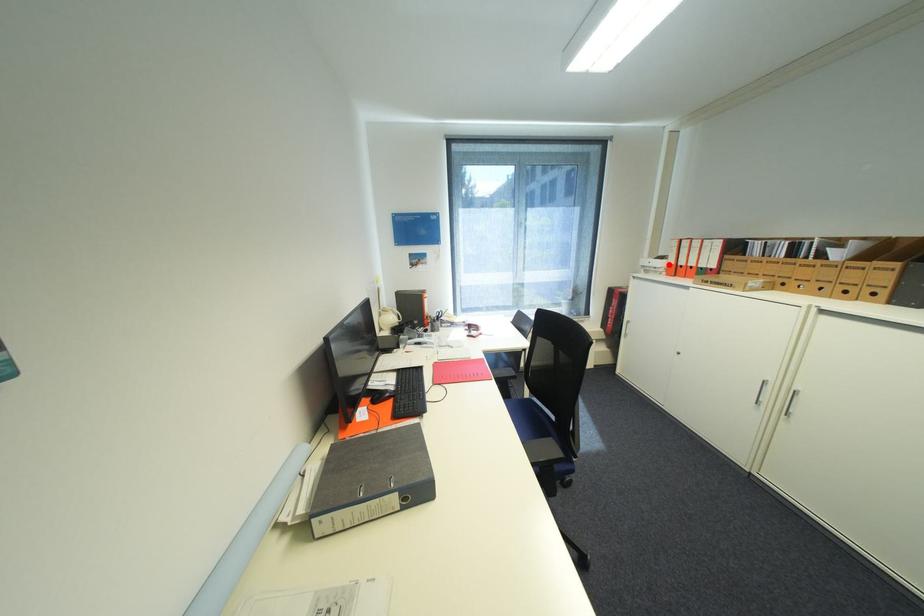
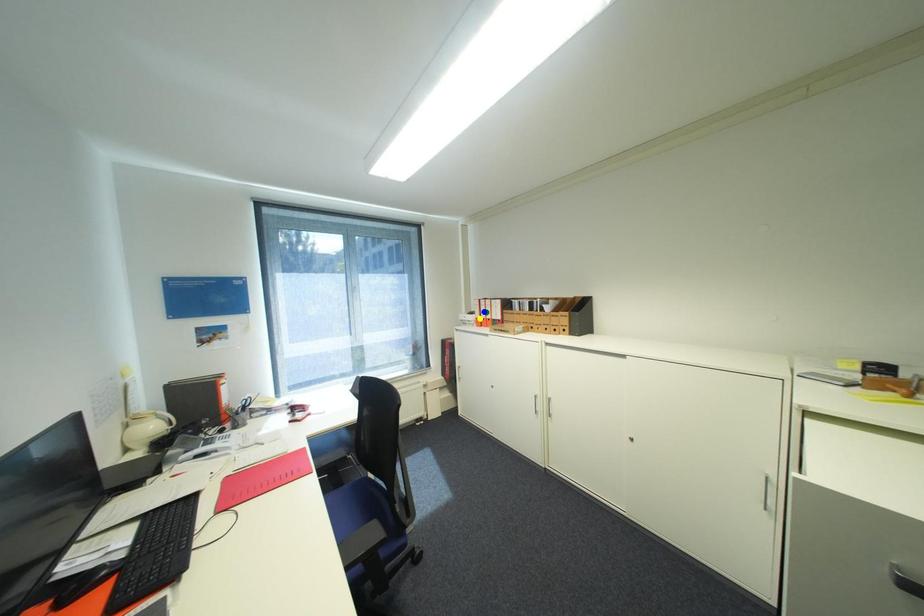
Question: I am providing you with two images of the same scene from different viewpoints. A red point is marked on the first image. You are given multiple points on the second image. Which point in image 2 is actually the same real-world point as the red point in image 1?

Choices:
 (A) green point
 (B) blue point
 (C) yellow point

Answer: (C)